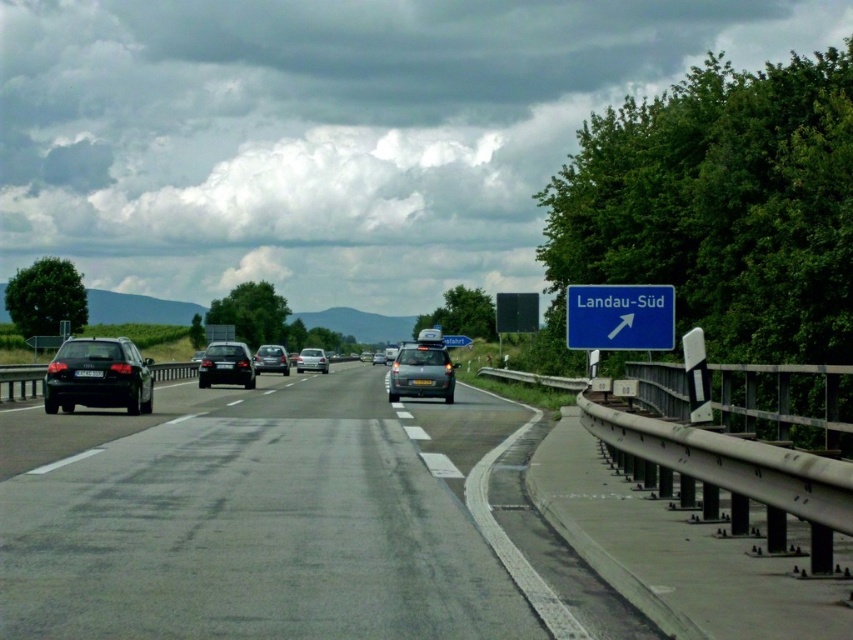
Question: Does black plastic license plate at center have a greater width compared to yellow matte license plate at center?

Choices:
 (A) yes
 (B) no

Answer: (B)

Question: In this image, where is satin silver car at center located relative to satin silver sedan at center?

Choices:
 (A) left
 (B) right

Answer: (B)

Question: Which of the following is the closest to the observer?

Choices:
 (A) satin silver car at center
 (B) black plastic license plate at center
 (C) shiny black sedan at left

Answer: (C)

Question: Is blue metallic sign at upper right above shiny black sedan at center?

Choices:
 (A) no
 (B) yes

Answer: (B)

Question: Among these objects, which one is nearest to the camera?

Choices:
 (A) blue metallic sign at upper right
 (B) satin silver car at center
 (C) gray asphalt highway at center
 (D) black plastic license plate at center

Answer: (C)

Question: Which point is closer to the camera?

Choices:
 (A) black plastic license plate at center
 (B) shiny black sedan at center
 (C) matte gray sedan at center
 (D) shiny metallic car at center

Answer: (A)